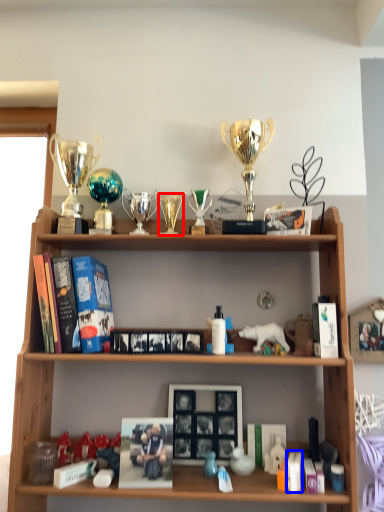
Question: Which of the following is the farthest to the observer, candle holder (highlighted by a red box) or book (highlighted by a blue box)?

Choices:
 (A) candle holder
 (B) book

Answer: (A)